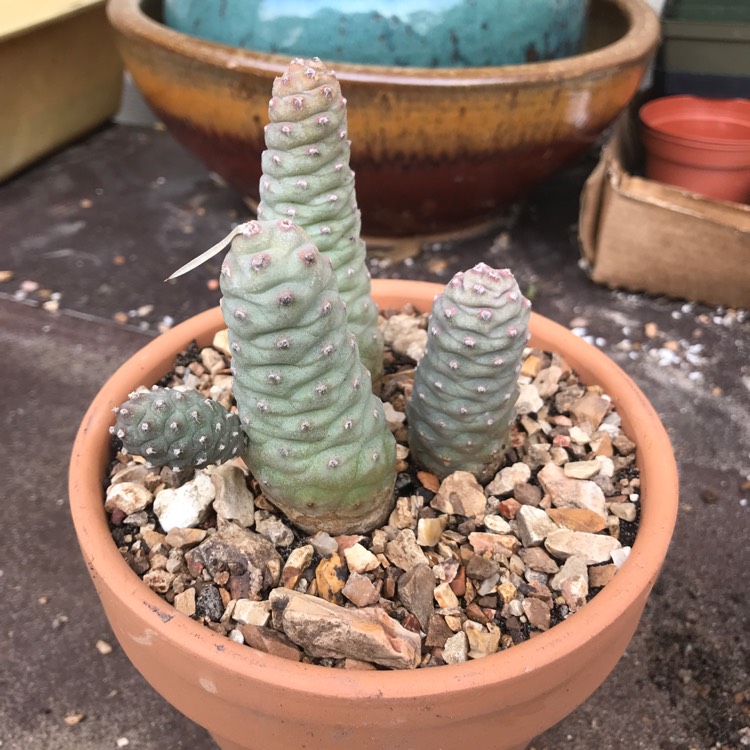
In order to click on tabletop in this screenshot , I will do `click(43, 418)`.